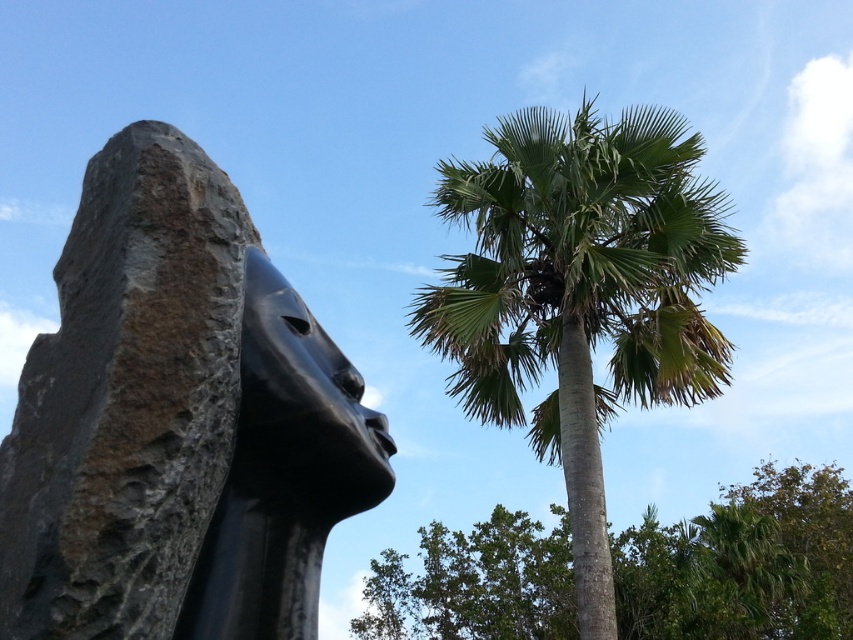
You are standing in front of the black polished stone sculpture at center. If you take one step forward, will you be closer to the sculpture than the distance mentioned in the description?

The black polished stone sculpture at center is 1.59 meters from camera. If you take one step forward, you will be closer than 1.59 meters to the sculpture.

You are standing in the middle of the image and want to walk directly towards the black polished stone sculpture at center. Which direction should you walk?

Since the black polished stone sculpture at center is located at point (177, 420), you should walk towards the upper right direction to reach it.

You are standing in the garden where the modern sculpture and palm trees are. You want to take a photo of both the green leafy palm at upper right and the green leafy tree at center. To include both in your shot, should you pan your camera to the left or the right?

Since the green leafy palm at upper right is to the left of the green leafy tree at center, you should pan your camera to the right to include both in your shot.